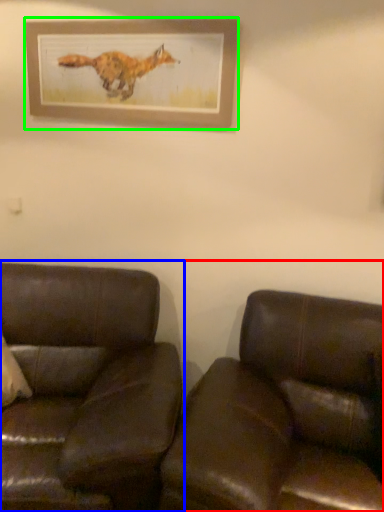
Question: Which object is the farthest from studio couch (highlighted by a red box)? Choose among these: studio couch (highlighted by a blue box) or picture frame (highlighted by a green box).

Choices:
 (A) studio couch
 (B) picture frame

Answer: (B)